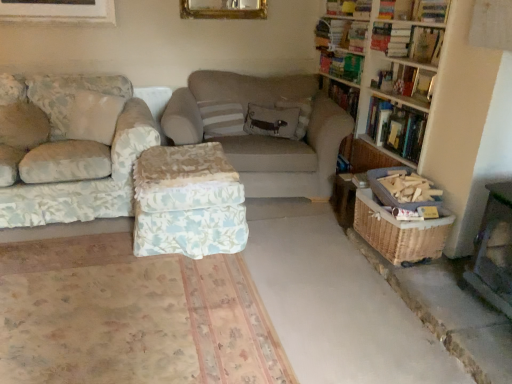
Find the location of `vacant space that's between floral fabric ottoman at center and woven wicker basket at lower right`. vacant space that's between floral fabric ottoman at center and woven wicker basket at lower right is located at coordinates pyautogui.click(x=289, y=227).